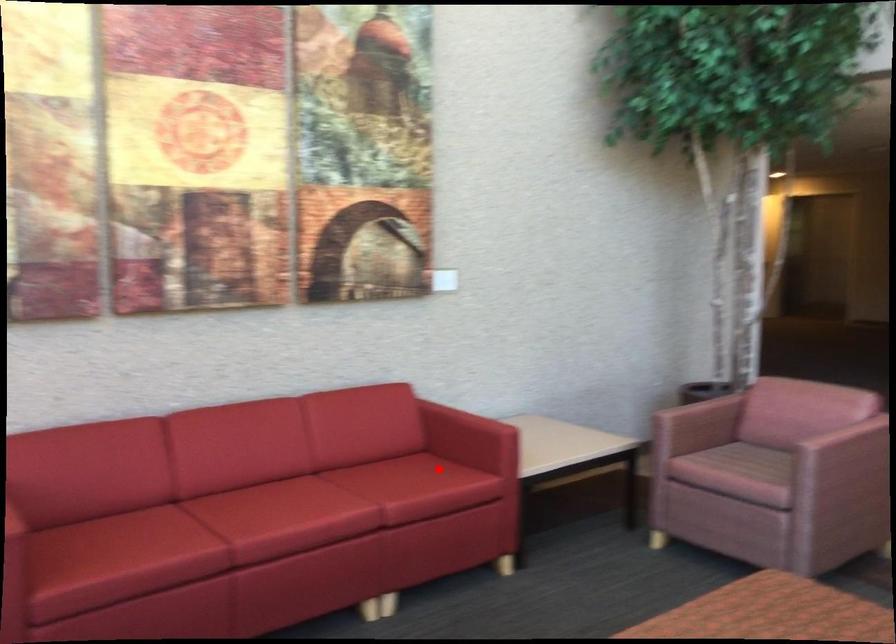
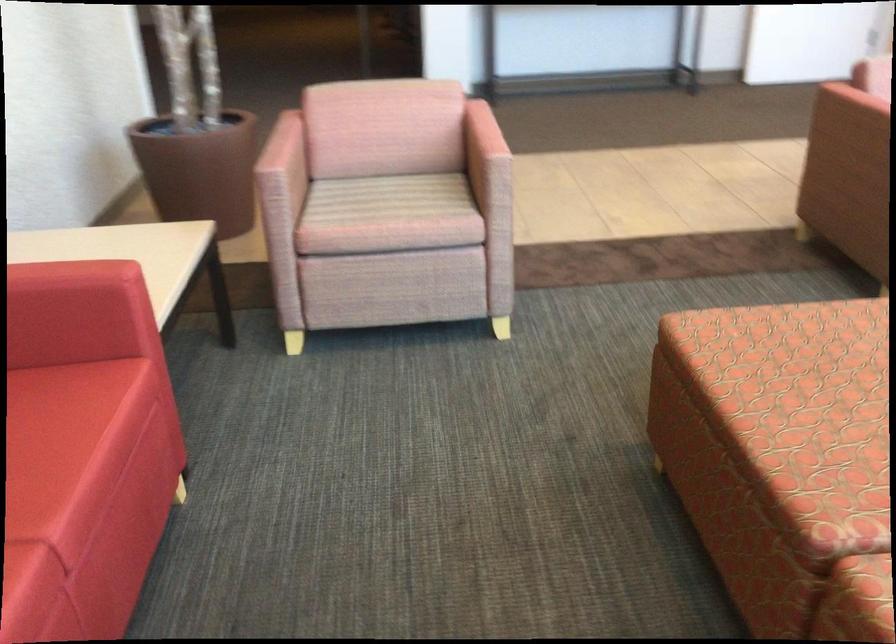
The point at the highlighted location is marked in the first image. Where is the corresponding point in the second image?

(38, 408)